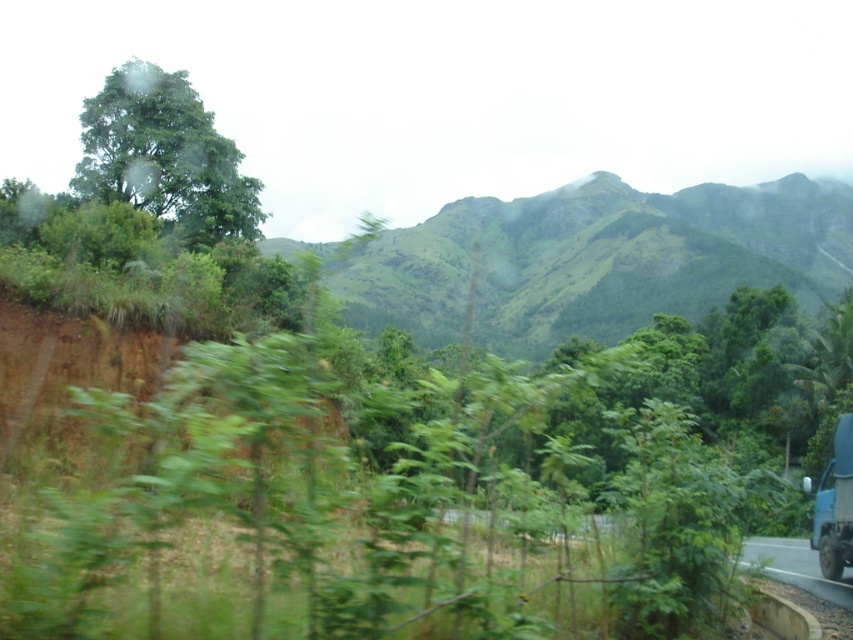
Is green grassy mountain at center in front of green leafy tree at upper left?

No, green grassy mountain at center is further to the viewer.

Which is behind, point (619, 218) or point (167, 212)?

The point (619, 218) is behind.

Does point (647, 273) come in front of point (86, 177)?

That is False.

The image size is (853, 640). Find the location of `green grassy mountain at center`. green grassy mountain at center is located at coordinates (598, 259).

Can you confirm if green leafy tree at upper left is thinner than transparent glass train window at lower right?

In fact, green leafy tree at upper left might be wider than transparent glass train window at lower right.

Between green leafy tree at upper left and transparent glass train window at lower right, which one appears on the left side from the viewer's perspective?

Positioned to the left is green leafy tree at upper left.

Measure the distance between point (106, 88) and camera.

The distance of point (106, 88) from camera is 47.11 meters.

Where is `green leafy tree at upper left`? Image resolution: width=853 pixels, height=640 pixels. green leafy tree at upper left is located at coordinates (164, 156).

This screenshot has width=853, height=640. Describe the element at coordinates (598, 259) in the screenshot. I see `green grassy mountain at center` at that location.

How far apart are green grassy mountain at center and blue metallic trailer truck at lower right?

A distance of 129.63 meters exists between green grassy mountain at center and blue metallic trailer truck at lower right.

Who is more distant from viewer, (602, 262) or (833, 577)?

Positioned behind is point (602, 262).

Where is `green grassy mountain at center`? This screenshot has width=853, height=640. green grassy mountain at center is located at coordinates (598, 259).